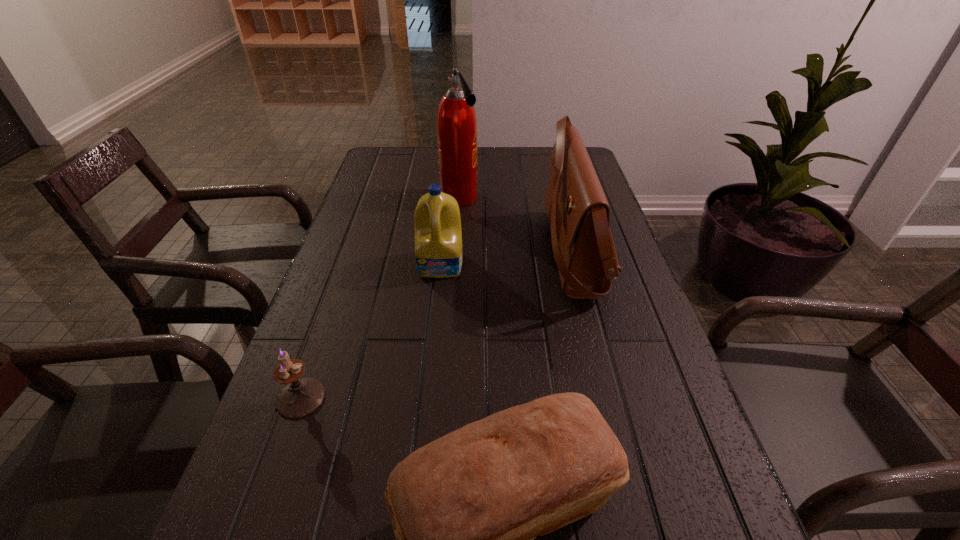
Image resolution: width=960 pixels, height=540 pixels. Identify the location of the tallest object. (456, 122).

The height and width of the screenshot is (540, 960). Find the location of `the fourth shortest object`. the fourth shortest object is located at coordinates (578, 213).

In order to click on detergent in this screenshot , I will do `click(438, 236)`.

Where is `candle holder`? Image resolution: width=960 pixels, height=540 pixels. candle holder is located at coordinates (300, 397).

At what (x,y) coordinates should I click in order to perform the action: click on the fourth farthest object. Please return your answer as a coordinate pair (x, y). Looking at the image, I should click on (300, 397).

The image size is (960, 540). I want to click on free region located 0.210m on the right of the tallest object, so click(549, 199).

Where is `vacant space located 0.200m on the front flap of the satchel`? vacant space located 0.200m on the front flap of the satchel is located at coordinates (460, 252).

I want to click on free space located on the front flap of the satchel, so click(x=388, y=252).

Where is `vacant space located on the front flap of the satchel`? The width and height of the screenshot is (960, 540). vacant space located on the front flap of the satchel is located at coordinates (384, 252).

Locate an element on the screen. free point located on the label of the detergent is located at coordinates (437, 306).